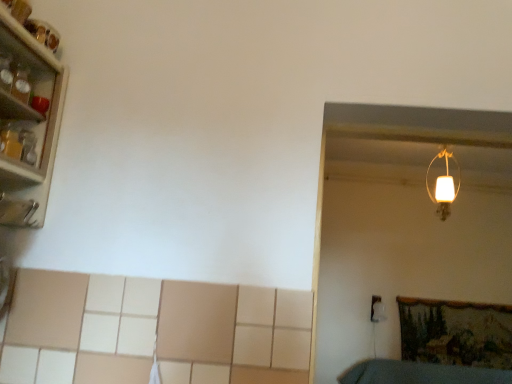
What do you see at coordinates (444, 186) in the screenshot? I see `white matte lampshade at upper right` at bounding box center [444, 186].

Where is `white matte lampshade at upper right`? Image resolution: width=512 pixels, height=384 pixels. white matte lampshade at upper right is located at coordinates (444, 186).

The height and width of the screenshot is (384, 512). Find the location of `metallic glassware at left`. metallic glassware at left is located at coordinates (27, 122).

The image size is (512, 384). Describe the element at coordinates (27, 122) in the screenshot. I see `metallic glassware at left` at that location.

I want to click on white matte lampshade at upper right, so click(444, 186).

Considering the positions of objects metallic glassware at left and white matte lampshade at upper right in the image provided, who is more to the left, metallic glassware at left or white matte lampshade at upper right?

metallic glassware at left.

Is the position of metallic glassware at left more distant than that of white matte lampshade at upper right?

That is False.

Is point (46, 200) positioned before point (440, 216)?

Yes.

From the image's perspective, does metallic glassware at left appear higher than white matte lampshade at upper right?

Indeed, from the image's perspective, metallic glassware at left is shown above white matte lampshade at upper right.

From a real-world perspective, is metallic glassware at left below white matte lampshade at upper right?

Correct, in the physical world, metallic glassware at left is lower than white matte lampshade at upper right.

Which object is thinner, metallic glassware at left or white matte lampshade at upper right?

Thinner between the two is white matte lampshade at upper right.

Can you confirm if metallic glassware at left is taller than white matte lampshade at upper right?

No, metallic glassware at left is not taller than white matte lampshade at upper right.

Can you confirm if metallic glassware at left is bigger than white matte lampshade at upper right?

Yes.

Is metallic glassware at left outside of white matte lampshade at upper right?

Yes, metallic glassware at left is outside of white matte lampshade at upper right.

Is metallic glassware at left next to white matte lampshade at upper right and touching it?

metallic glassware at left and white matte lampshade at upper right are clearly separated.

Based on the photo, is metallic glassware at left turned away from white matte lampshade at upper right?

No, metallic glassware at left's orientation is not away from white matte lampshade at upper right.

What's the angular difference between metallic glassware at left and white matte lampshade at upper right's facing directions?

The angular difference between metallic glassware at left and white matte lampshade at upper right is 87.2 degrees.

The width and height of the screenshot is (512, 384). I want to click on lamp on the right of metallic glassware at left, so click(444, 186).

Is white matte lampshade at upper right to the left of metallic glassware at left from the viewer's perspective?

No, white matte lampshade at upper right is not to the left of metallic glassware at left.

Is white matte lampshade at upper right closer to camera compared to metallic glassware at left?

No, white matte lampshade at upper right is behind metallic glassware at left.

Is point (441, 213) positioned behind point (10, 149)?

Yes, point (441, 213) is farther from viewer.

From the image's perspective, who appears lower, white matte lampshade at upper right or metallic glassware at left?

white matte lampshade at upper right is shown below in the image.

From a real-world perspective, between white matte lampshade at upper right and metallic glassware at left, who is vertically lower?

metallic glassware at left, from a real-world perspective.

Is white matte lampshade at upper right wider or thinner than metallic glassware at left?

Clearly, white matte lampshade at upper right has less width compared to metallic glassware at left.

Is white matte lampshade at upper right taller than metallic glassware at left?

Yes, white matte lampshade at upper right is taller than metallic glassware at left.

Looking at this image, considering the relative sizes of white matte lampshade at upper right and metallic glassware at left in the image provided, is white matte lampshade at upper right bigger than metallic glassware at left?

No.

Would you say white matte lampshade at upper right is outside metallic glassware at left?

Absolutely, white matte lampshade at upper right is external to metallic glassware at left.

Are white matte lampshade at upper right and metallic glassware at left far apart?

Absolutely, white matte lampshade at upper right is distant from metallic glassware at left.

Is white matte lampshade at upper right oriented towards metallic glassware at left?

No.

How different are the orientations of white matte lampshade at upper right and metallic glassware at left in degrees?

87.2 degrees separate the facing orientations of white matte lampshade at upper right and metallic glassware at left.

At what (x,y) coordinates should I click in order to perform the action: click on lamp lying on the right of metallic glassware at left. Please return your answer as a coordinate pair (x, y). This screenshot has width=512, height=384. Looking at the image, I should click on (444, 186).

What are the coordinates of `shelf to the left of white matte lampshade at upper right` in the screenshot? It's located at (27, 122).

This screenshot has width=512, height=384. What are the coordinates of `shelf lying above the white matte lampshade at upper right (from the image's perspective)` in the screenshot? It's located at (27, 122).